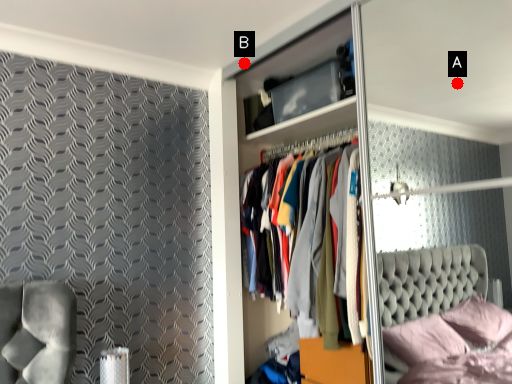
Question: Two points are circled on the image, labeled by A and B beside each circle. Among these points, which one is farthest from the camera?

Choices:
 (A) A is further
 (B) B is further

Answer: (A)